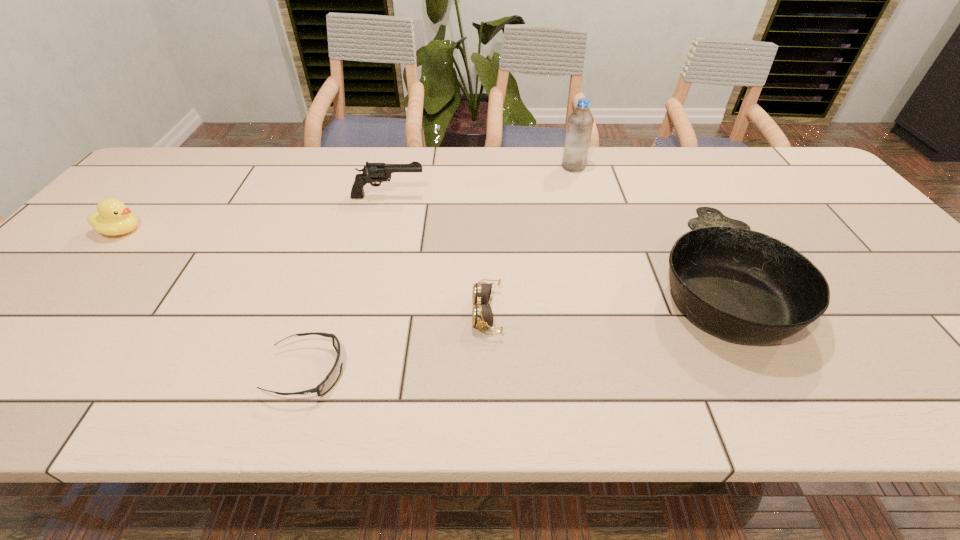
Where is `the second object from right to left`? The height and width of the screenshot is (540, 960). the second object from right to left is located at coordinates (580, 122).

Find the location of a particular element. This screenshot has width=960, height=540. the farthest object is located at coordinates (580, 122).

Locate an element on the screen. This screenshot has height=540, width=960. gun is located at coordinates (375, 172).

Where is `the rightmost object`? The height and width of the screenshot is (540, 960). the rightmost object is located at coordinates (742, 285).

At what (x,y) coordinates should I click in order to perform the action: click on duckling. Please return your answer as a coordinate pair (x, y). This screenshot has height=540, width=960. Looking at the image, I should click on (113, 218).

Where is `the right goggles`? the right goggles is located at coordinates (482, 316).

Where is `the farther goggles`? Image resolution: width=960 pixels, height=540 pixels. the farther goggles is located at coordinates (482, 316).

Image resolution: width=960 pixels, height=540 pixels. I want to click on the left goggles, so (x=332, y=377).

I want to click on free point located 0.260m on the right of the water bottle, so click(x=667, y=167).

Find the location of a particular element. This screenshot has width=960, height=540. vacant region located 0.100m at the end of the barrel of the second farthest object is located at coordinates (459, 197).